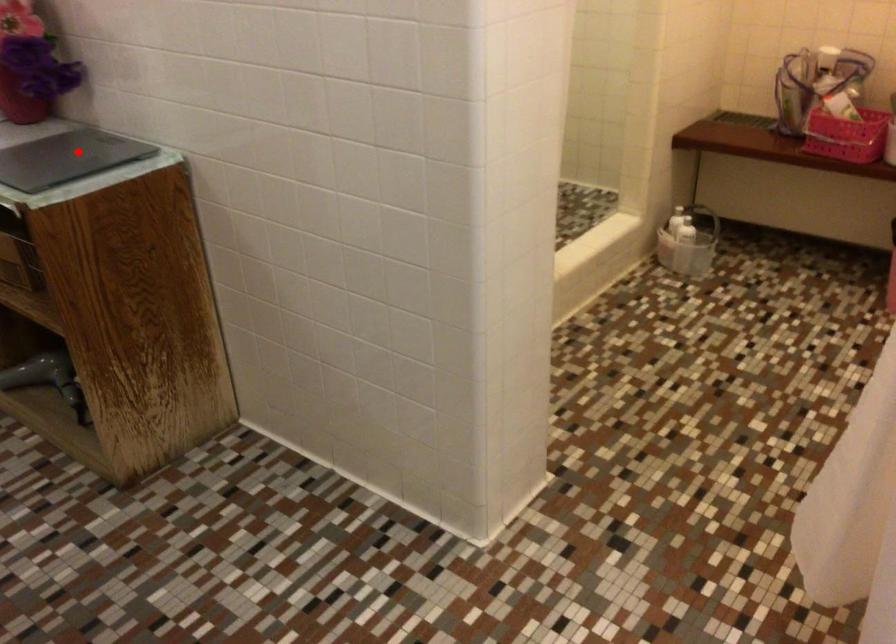
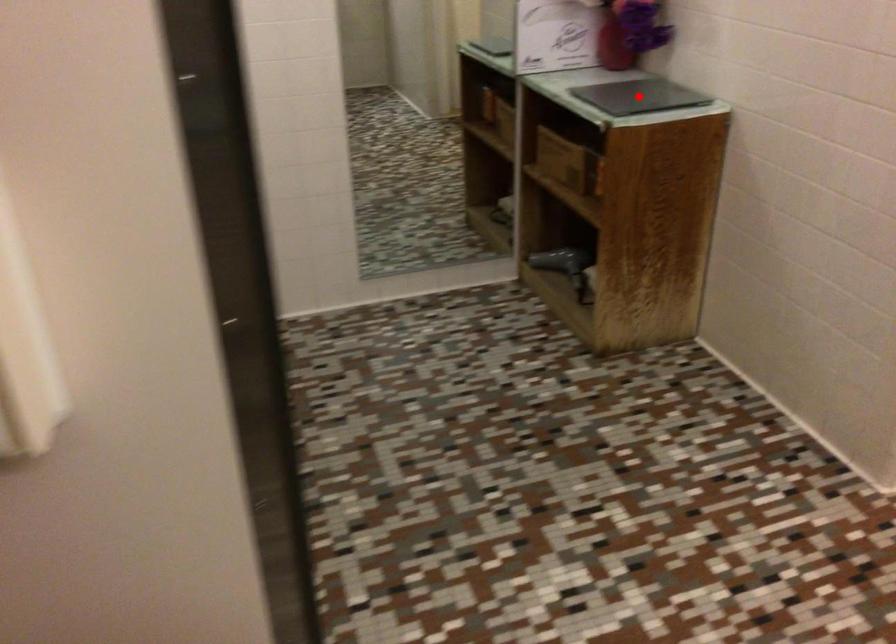
I am providing you with two images of the same scene from different viewpoints. A red point is marked on the first image and another point is marked on the second image. Is the red point in image1 aligned with the point shown in image2?

Yes